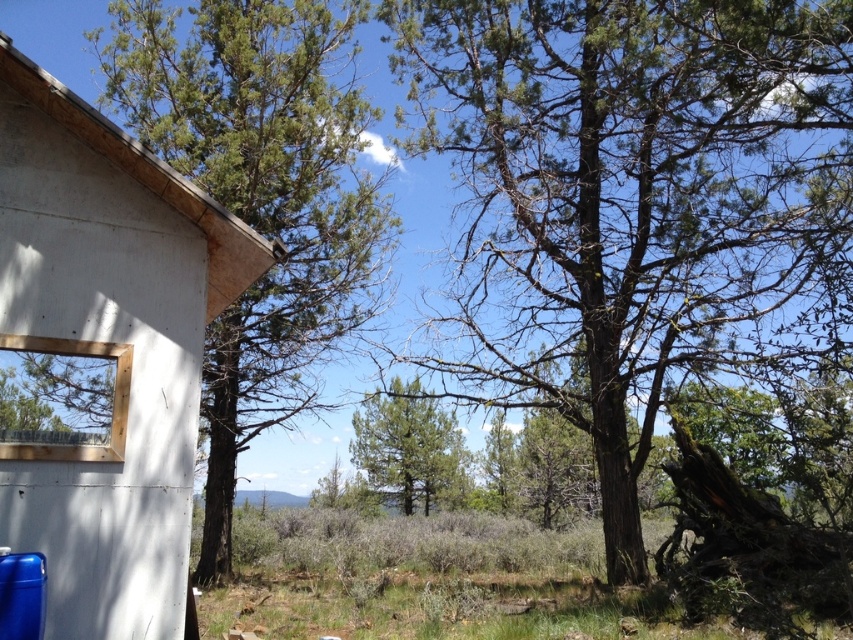
Is green rough bark tree at center bigger than green needle-like at left?

Incorrect, green rough bark tree at center is not larger than green needle-like at left.

Is point (392, 40) positioned behind point (328, 177)?

That is False.

Find the location of a particular element. The height and width of the screenshot is (640, 853). green rough bark tree at center is located at coordinates (628, 198).

Who is taller, green needle-like at left or green leafy tree at center?

green needle-like at left

Does point (350, 113) lie behind point (364, 452)?

No, (350, 113) is closer to viewer.

Measure the distance between green needle-like at left and camera.

They are 13.25 meters apart.

The height and width of the screenshot is (640, 853). Identify the location of green needle-like at left. (260, 196).

How distant is green rough bark tree at center from white concrete hut at left?

A distance of 8.56 meters exists between green rough bark tree at center and white concrete hut at left.

Between green rough bark tree at center and white concrete hut at left, which one has more height?

Standing taller between the two is white concrete hut at left.

Who is more forward, [548,365] or [15,120]?

Point [15,120]

The height and width of the screenshot is (640, 853). Identify the location of green rough bark tree at center. (628, 198).